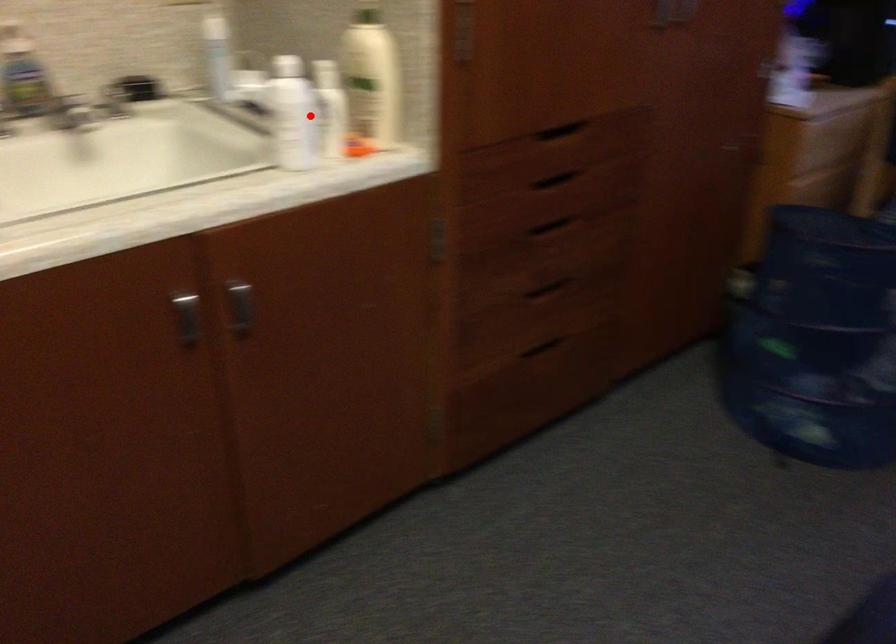
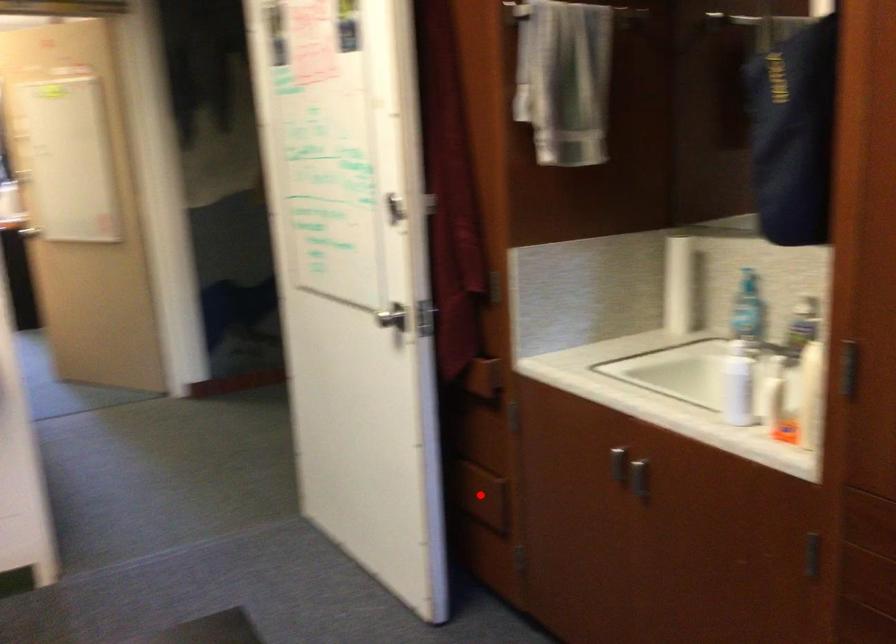
I am providing you with two images of the same scene from different viewpoints. A red point is marked on the first image and another point is marked on the second image. Is the red point in image1 aligned with the point shown in image2?

No